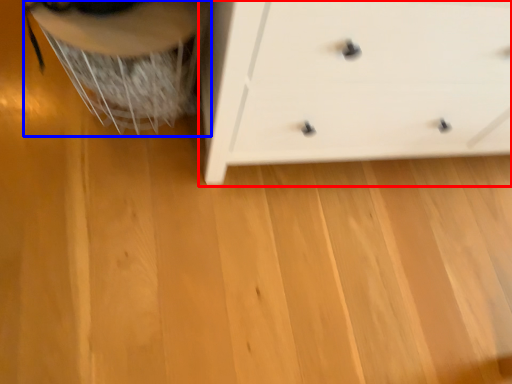
Question: Which object is closer to the camera taking this photo, chest of drawers (highlighted by a red box) or swivel chair (highlighted by a blue box)?

Choices:
 (A) chest of drawers
 (B) swivel chair

Answer: (A)